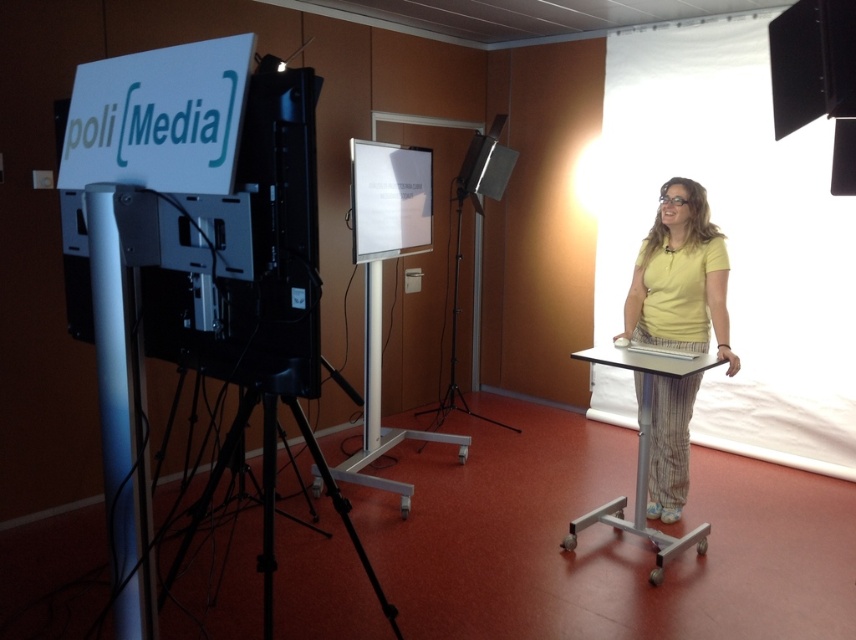
Question: Does white matte sign at upper left have a greater width compared to black matte tripod at lower left?

Choices:
 (A) no
 (B) yes

Answer: (A)

Question: Which object is the closest to the yellow cotton shirt at center?

Choices:
 (A) black matte tripod at lower left
 (B) white matte sign at upper left

Answer: (A)

Question: Which point is farther to the camera?

Choices:
 (A) black matte tripod at lower left
 (B) yellow cotton shirt at center
 (C) white glossy projection screen at center

Answer: (C)

Question: Which of the following is the farthest from the observer?

Choices:
 (A) black matte tripod at center
 (B) white glossy projection screen at center

Answer: (A)

Question: Can you confirm if white matte sign at upper left is wider than black matte tripod at lower left?

Choices:
 (A) no
 (B) yes

Answer: (A)

Question: Does white glossy projection screen at center have a larger size compared to black matte tripod at lower left?

Choices:
 (A) yes
 (B) no

Answer: (B)